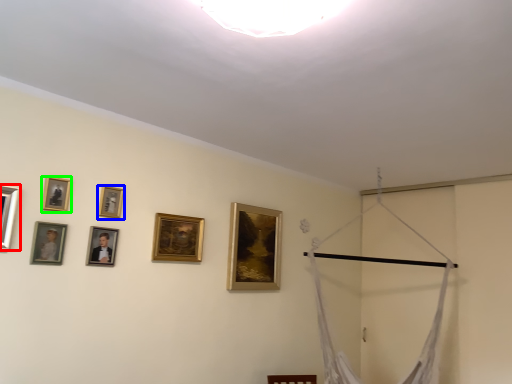
Question: Considering the real-world distances, which object is farthest from picture frame (highlighted by a red box)? picture frame (highlighted by a blue box) or picture frame (highlighted by a green box)?

Choices:
 (A) picture frame
 (B) picture frame

Answer: (A)